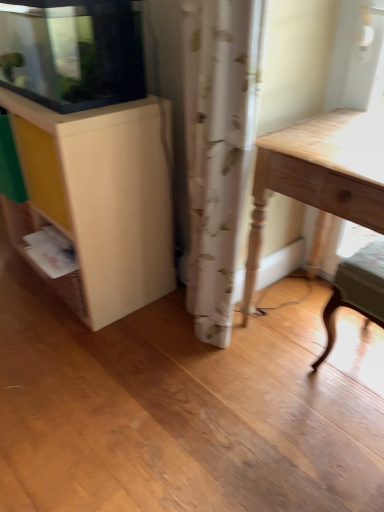
The height and width of the screenshot is (512, 384). In order to click on vacant space in front of matte white cabinet at left, which appears as the 2th cabinetry when viewed from the top in this screenshot , I will do `click(94, 356)`.